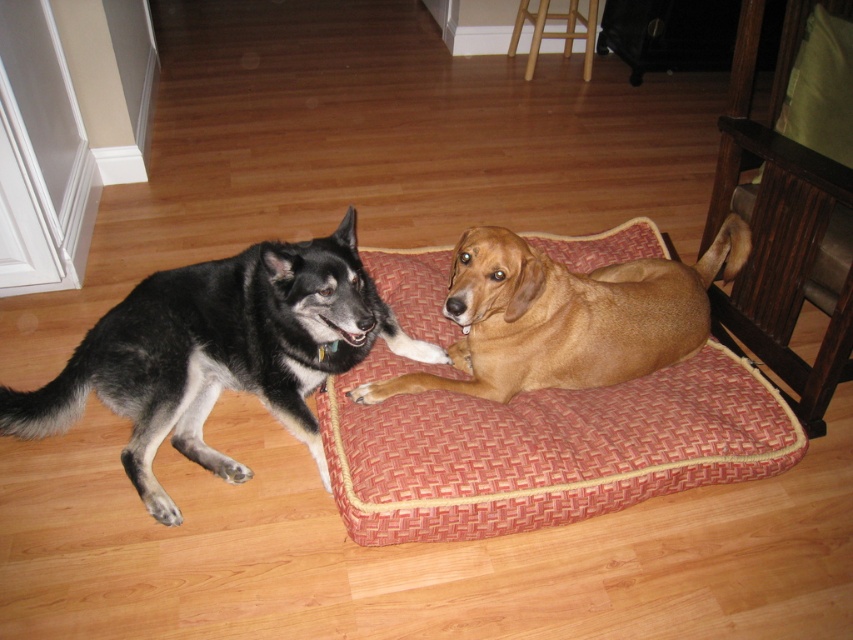
You are a dog owner who wants to place a new toy between the red woven fabric dog bed at center and the brown furry dog at center. Based on their positions, where should you place the toy so it is closer to the dog but still near the bed?

The red woven fabric dog bed at center is positioned on the left side of brown furry dog at center. Therefore, placing the toy to the right of the bed but still near it would position it closer to the dog while maintaining proximity to the bed.

You are a new pet owner trying to rearrange the furniture in the living room. You want to place a new toy between the red woven fabric dog bed at center and the black fur dog at left. Based on their current positions, where should you place the toy to ensure it is between them?

The red woven fabric dog bed at center is located above the black fur dog at left, so you should place the toy between them in the space below the dog bed and above the black fur dog.

You are a pet sitter who needs to place a new dog toy between the red woven fabric dog bed at center and the black fur dog at left. Based on their sizes, which object should the toy be closer to?

The red woven fabric dog bed at center is wider than the black fur dog at left, so the toy should be placed closer to the red woven fabric dog bed at center to ensure enough space between them.